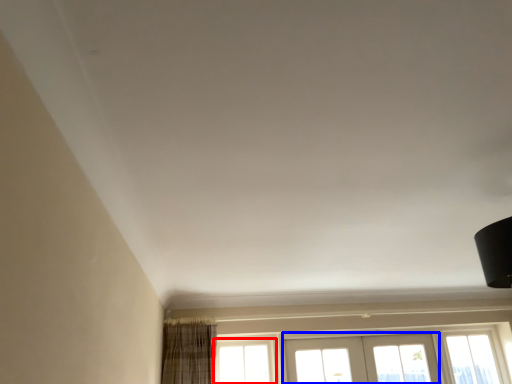
Question: Which object appears closest to the camera in this image, window (highlighted by a red box) or screen door (highlighted by a blue box)?

Choices:
 (A) window
 (B) screen door

Answer: (A)